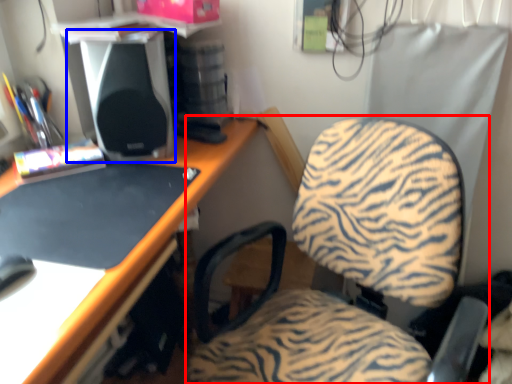
Question: Which object is closer to the camera taking this photo, chair (highlighted by a red box) or speaker (highlighted by a blue box)?

Choices:
 (A) chair
 (B) speaker

Answer: (A)